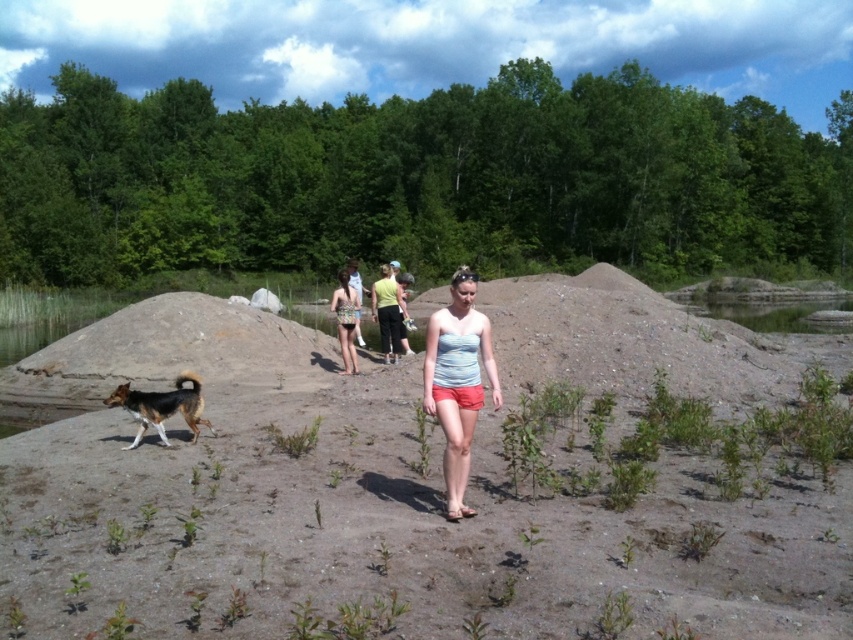
Question: Is brown sandy soil at center further to camera compared to brown and black fur dog at lower left?

Choices:
 (A) yes
 (B) no

Answer: (B)

Question: Does light blue fabric top at center appear over brown and black fur dog at lower left?

Choices:
 (A) no
 (B) yes

Answer: (B)

Question: Which object is farther from the camera taking this photo?

Choices:
 (A) brown sandy soil at center
 (B) patterned swimsuit at center
 (C) brown and black fur dog at lower left

Answer: (B)

Question: Estimate the real-world distances between objects in this image. Which object is closer to the brown and black fur dog at lower left?

Choices:
 (A) patterned swimsuit at center
 (B) brown sandy soil at center
 (C) light blue fabric top at center

Answer: (C)

Question: Is light blue fabric top at center positioned at the back of brown and black fur dog at lower left?

Choices:
 (A) no
 (B) yes

Answer: (A)

Question: Which point is closer to the camera taking this photo?

Choices:
 (A) (450, 371)
 (B) (604, 563)
 (C) (346, 333)

Answer: (B)